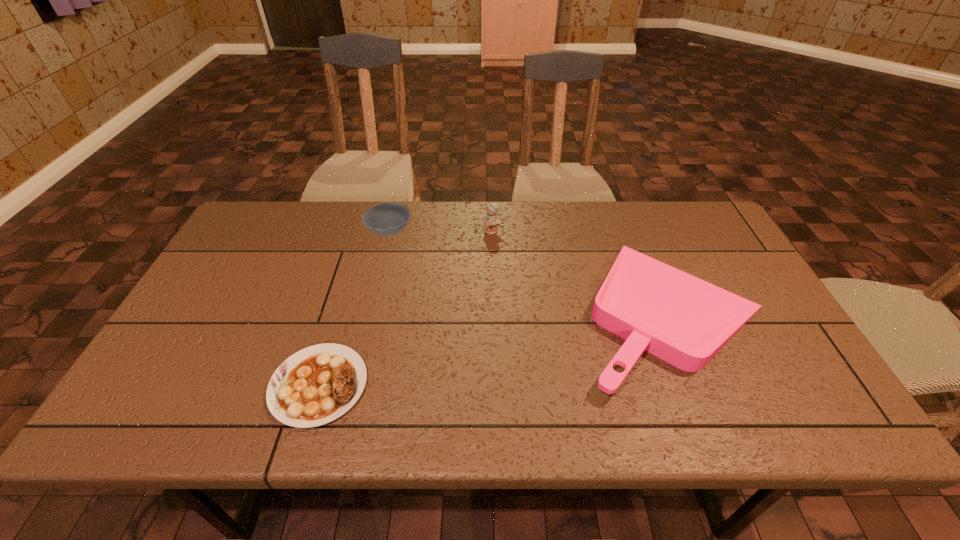
The image size is (960, 540). What are the coordinates of `vacant area between the bowl and the shortest object` in the screenshot? It's located at (354, 308).

I want to click on vacant space that's between the bowl and the shortest object, so click(354, 308).

Where is `blank region between the shortest object and the dustpan`? blank region between the shortest object and the dustpan is located at coordinates (494, 348).

Identify the location of vacant area that lies between the tallest object and the steak. (405, 308).

Identify which object is located as the second nearest to the bowl. Please provide its 2D coordinates. Your answer should be formatted as a tuple, i.e. [(x, y)], where the tuple contains the x and y coordinates of a point satisfying the conditions above.

[(318, 384)]

Identify which object is the third nearest to the rightmost object. Please provide its 2D coordinates. Your answer should be formatted as a tuple, i.e. [(x, y)], where the tuple contains the x and y coordinates of a point satisfying the conditions above.

[(318, 384)]

The image size is (960, 540). Identify the location of free space that satisfies the following two spatial constraints: 1. on the back side of the shortest object; 2. on the left side of the bowl. (365, 232).